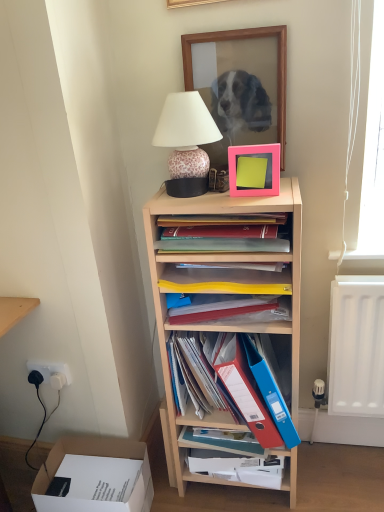
Question: Is wooden picture frame at upper center, the 2th picture frame in the bottom-to-top sequence, positioned in front of blue plastic folder at center?

Choices:
 (A) yes
 (B) no

Answer: (B)

Question: Is wooden picture frame at upper center, the 2th picture frame in the bottom-to-top sequence, bigger than blue plastic folder at center?

Choices:
 (A) no
 (B) yes

Answer: (A)

Question: From a real-world perspective, is wooden picture frame at upper center, the 2th picture frame in the bottom-to-top sequence, on blue plastic folder at center?

Choices:
 (A) no
 (B) yes

Answer: (B)

Question: Is wooden picture frame at upper center, the 2th picture frame in the bottom-to-top sequence, further to the viewer compared to blue plastic folder at center?

Choices:
 (A) no
 (B) yes

Answer: (B)

Question: Is wooden picture frame at upper center, which appears as the first picture frame when viewed from the back, oriented towards blue plastic folder at center?

Choices:
 (A) yes
 (B) no

Answer: (B)

Question: Is wooden picture frame at upper center, the 2th picture frame in the front-to-back sequence, shorter than blue plastic folder at center?

Choices:
 (A) yes
 (B) no

Answer: (B)

Question: Considering the relative sizes of matte plastic books at upper center, the first book positioned from the top, and leopard print ceramic lamp at upper center in the image provided, is matte plastic books at upper center, the first book positioned from the top, bigger than leopard print ceramic lamp at upper center?

Choices:
 (A) no
 (B) yes

Answer: (A)

Question: Considering the relative sizes of matte plastic books at upper center, the first book positioned from the top, and leopard print ceramic lamp at upper center in the image provided, is matte plastic books at upper center, the first book positioned from the top, wider than leopard print ceramic lamp at upper center?

Choices:
 (A) yes
 (B) no

Answer: (A)

Question: Does matte plastic books at upper center, the first book positioned from the top, turn towards leopard print ceramic lamp at upper center?

Choices:
 (A) no
 (B) yes

Answer: (A)

Question: Can you confirm if matte plastic books at upper center, the 3th book when ordered from bottom to top, is positioned to the left of leopard print ceramic lamp at upper center?

Choices:
 (A) no
 (B) yes

Answer: (A)

Question: Are matte plastic books at upper center, the 3th book when ordered from bottom to top, and leopard print ceramic lamp at upper center located far from each other?

Choices:
 (A) yes
 (B) no

Answer: (B)

Question: Is matte plastic books at upper center, the 3th book when ordered from bottom to top, behind leopard print ceramic lamp at upper center?

Choices:
 (A) no
 (B) yes

Answer: (B)

Question: From a real-world perspective, is white cardboard box at lower left physically above light wood shelf at center?

Choices:
 (A) no
 (B) yes

Answer: (A)